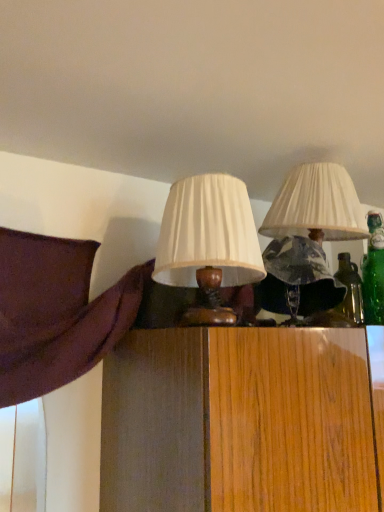
Question: Is matte white lampshade at center, which ranks as the 1th lamp in right-to-left order, inside the boundaries of matte white lampshade at center, the second lamp in the right-to-left sequence, or outside?

Choices:
 (A) outside
 (B) inside

Answer: (A)

Question: In terms of size, does matte white lampshade at center, which ranks as the 1th lamp in right-to-left order, appear bigger or smaller than matte white lampshade at center, the second lamp in the right-to-left sequence?

Choices:
 (A) big
 (B) small

Answer: (A)

Question: From the image's perspective, relative to matte white lampshade at center, the second lamp in the right-to-left sequence, is matte white lampshade at center, the second lamp positioned from the left, above or below?

Choices:
 (A) above
 (B) below

Answer: (A)

Question: Is matte white lampshade at center, the second lamp in the right-to-left sequence, in front of or behind matte white lampshade at center, the second lamp positioned from the left, in the image?

Choices:
 (A) behind
 (B) front

Answer: (B)

Question: From their relative heights in the image, would you say matte white lampshade at center, placed as the first lamp when sorted from left to right, is taller or shorter than matte white lampshade at center, which ranks as the 1th lamp in right-to-left order?

Choices:
 (A) tall
 (B) short

Answer: (B)

Question: From a real-world perspective, relative to matte white lampshade at center, which ranks as the 1th lamp in right-to-left order, is matte white lampshade at center, the second lamp in the right-to-left sequence, vertically above or below?

Choices:
 (A) below
 (B) above

Answer: (A)

Question: In terms of width, does matte white lampshade at center, placed as the first lamp when sorted from left to right, look wider or thinner when compared to matte white lampshade at center, which ranks as the 1th lamp in right-to-left order?

Choices:
 (A) thin
 (B) wide

Answer: (A)